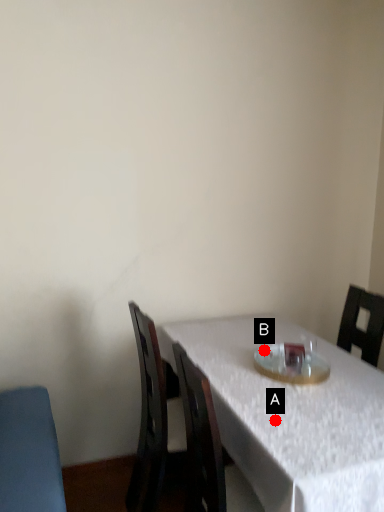
Question: Two points are circled on the image, labeled by A and B beside each circle. Among these points, which one is farthest from the camera?

Choices:
 (A) A is further
 (B) B is further

Answer: (B)